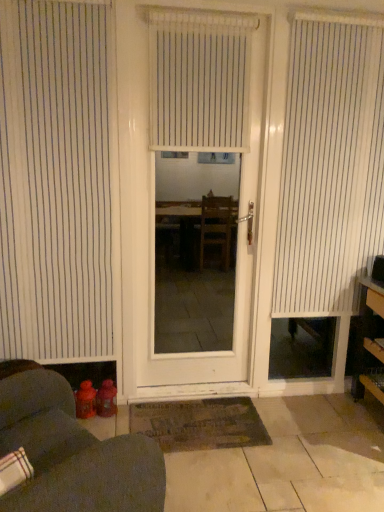
Question: Is dark brown textured mat at center looking in the opposite direction of white vertical blinds at center, which ranks as the second window blind in left-to-right order?

Choices:
 (A) yes
 (B) no

Answer: (B)

Question: Is dark brown textured mat at center placed right next to white vertical blinds at center, which ranks as the second window blind in left-to-right order?

Choices:
 (A) no
 (B) yes

Answer: (A)

Question: Is white vertical blinds at center, the second window blind in the right-to-left sequence, surrounded by dark brown textured mat at center?

Choices:
 (A) yes
 (B) no

Answer: (B)

Question: Would you say dark brown textured mat at center is a long distance from white vertical blinds at center, which ranks as the second window blind in left-to-right order?

Choices:
 (A) yes
 (B) no

Answer: (A)

Question: Could you tell me if dark brown textured mat at center is facing white vertical blinds at center, which ranks as the second window blind in left-to-right order?

Choices:
 (A) no
 (B) yes

Answer: (A)

Question: Considering the positions of white vertical blinds at right, the 3th window blind positioned from the left, and white vertical blinds at center, the second window blind in the right-to-left sequence, in the image, is white vertical blinds at right, the 3th window blind positioned from the left, bigger or smaller than white vertical blinds at center, the second window blind in the right-to-left sequence,?

Choices:
 (A) small
 (B) big

Answer: (B)

Question: In the image, is white vertical blinds at right, which ranks as the 1th window blind in right-to-left order, positioned in front of or behind white vertical blinds at center, which ranks as the second window blind in left-to-right order?

Choices:
 (A) front
 (B) behind

Answer: (B)

Question: Would you say white vertical blinds at right, the 3th window blind positioned from the left, is to the left or to the right of white vertical blinds at center, which ranks as the second window blind in left-to-right order, in the picture?

Choices:
 (A) right
 (B) left

Answer: (A)

Question: From a real-world perspective, is white vertical blinds at right, the 3th window blind positioned from the left, physically located above or below white vertical blinds at center, the second window blind in the right-to-left sequence?

Choices:
 (A) below
 (B) above

Answer: (A)

Question: Does point (221, 443) appear closer or farther from the camera than point (9, 510)?

Choices:
 (A) farther
 (B) closer

Answer: (A)

Question: Looking at the image, does dark brown textured mat at center seem bigger or smaller compared to matte red water bottles at lower left?

Choices:
 (A) small
 (B) big

Answer: (A)

Question: Considering their positions, is dark brown textured mat at center located in front of or behind matte red water bottles at lower left?

Choices:
 (A) behind
 (B) front

Answer: (A)

Question: Considering the positions of dark brown textured mat at center and matte red water bottles at lower left in the image, is dark brown textured mat at center wider or thinner than matte red water bottles at lower left?

Choices:
 (A) wide
 (B) thin

Answer: (B)

Question: From a real-world perspective, is white vertical blinds at center, which ranks as the second window blind in left-to-right order, positioned above or below wooden shelves at right?

Choices:
 (A) above
 (B) below

Answer: (A)

Question: Is white vertical blinds at center, which ranks as the second window blind in left-to-right order, situated inside wooden shelves at right or outside?

Choices:
 (A) inside
 (B) outside

Answer: (B)